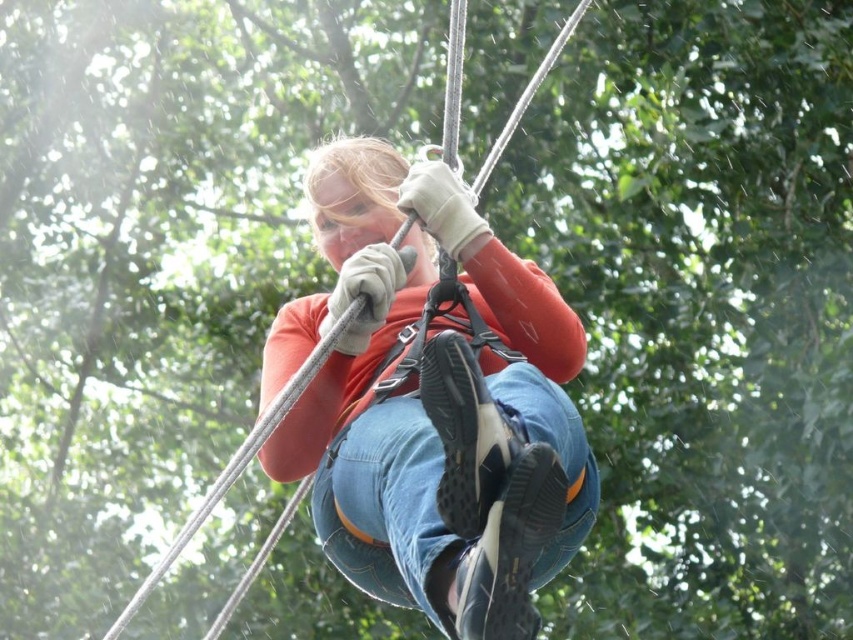
Question: Which object appears farthest from the camera in this image?

Choices:
 (A) matte orange shirt at center
 (B) denim at center

Answer: (A)

Question: Observing the image, what is the correct spatial positioning of matte orange shirt at center in reference to denim at center?

Choices:
 (A) right
 (B) left

Answer: (A)

Question: Is matte orange shirt at center closer to the viewer compared to denim at center?

Choices:
 (A) no
 (B) yes

Answer: (A)

Question: Does matte orange shirt at center have a smaller size compared to denim at center?

Choices:
 (A) no
 (B) yes

Answer: (B)